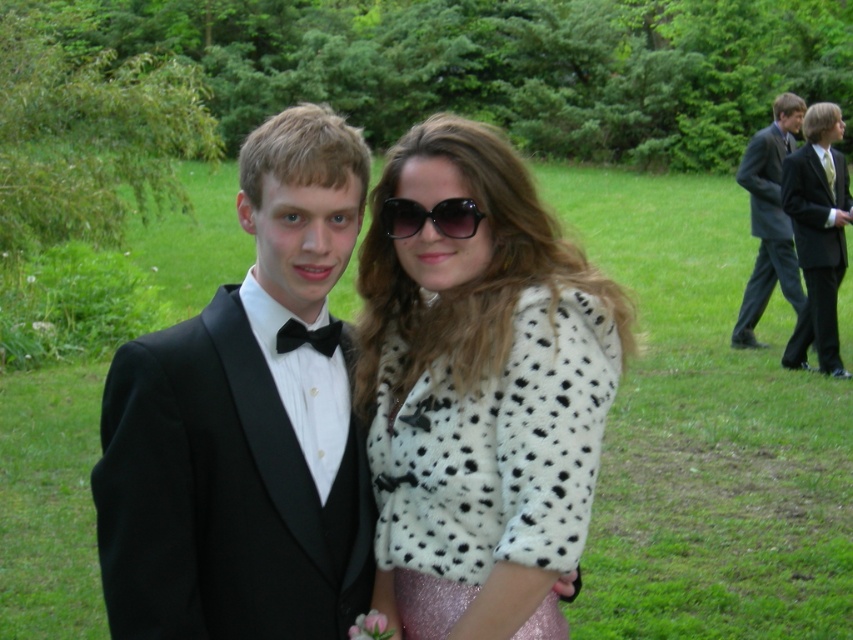
Does dark gray suit at right appear on the left side of black satin bow tie at center?

No, dark gray suit at right is not to the left of black satin bow tie at center.

Can you confirm if dark gray suit at right is bigger than black satin bow tie at center?

Yes, dark gray suit at right is bigger than black satin bow tie at center.

What do you see at coordinates (769, 218) in the screenshot?
I see `dark gray suit at right` at bounding box center [769, 218].

At what (x,y) coordinates should I click in order to perform the action: click on dark gray suit at right. Please return your answer as a coordinate pair (x, y). The image size is (853, 640). Looking at the image, I should click on 769,218.

Is white fur coat at center taller than black satin bow tie at center?

Correct, white fur coat at center is much taller as black satin bow tie at center.

The width and height of the screenshot is (853, 640). I want to click on white fur coat at center, so click(x=480, y=394).

Measure the distance between white fur coat at center and camera.

white fur coat at center is 2.16 meters from camera.

This screenshot has width=853, height=640. What are the coordinates of `white fur coat at center` in the screenshot? It's located at (480, 394).

Who is more forward, (566, 548) or (326, 451)?

Positioned in front is point (566, 548).

This screenshot has height=640, width=853. Describe the element at coordinates (480, 394) in the screenshot. I see `white fur coat at center` at that location.

Identify the location of white fur coat at center. (480, 394).